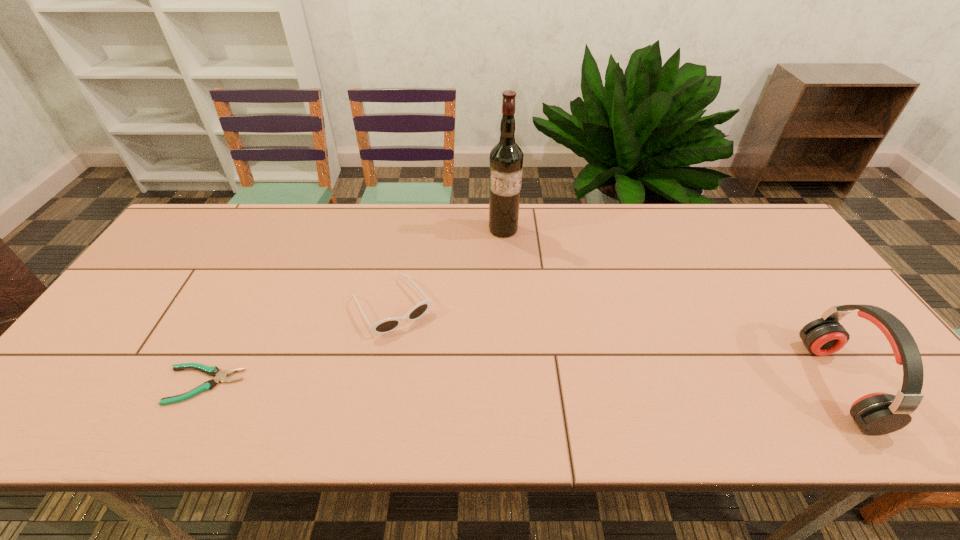
At what (x,y) coordinates should I click in order to perform the action: click on free spot that satisfies the following two spatial constraints: 1. on the back side of the tallest object; 2. on the right side of the second shortest object. Please return your answer as a coordinate pair (x, y). The width and height of the screenshot is (960, 540). Looking at the image, I should click on (407, 230).

Find the location of `free spot that satisfies the following two spatial constraints: 1. on the back side of the second object from right to left; 2. on the left side of the pliers`. free spot that satisfies the following two spatial constraints: 1. on the back side of the second object from right to left; 2. on the left side of the pliers is located at coordinates (283, 230).

Find the location of a particular element. free location that satisfies the following two spatial constraints: 1. on the front side of the second shortest object; 2. on the ear cups of the third shortest object is located at coordinates (377, 384).

I want to click on blank space that satisfies the following two spatial constraints: 1. on the back side of the third object from right to left; 2. on the left side of the pliers, so click(244, 306).